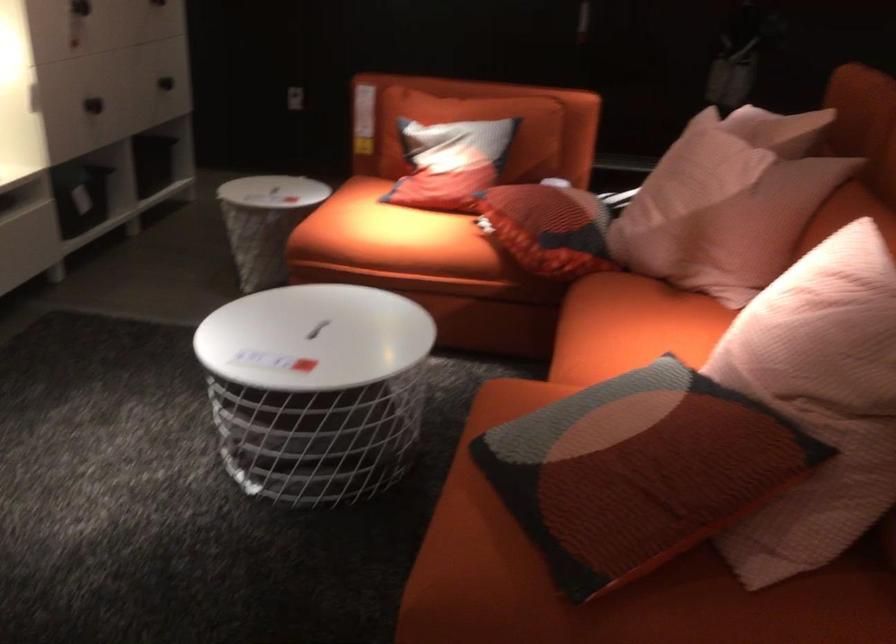
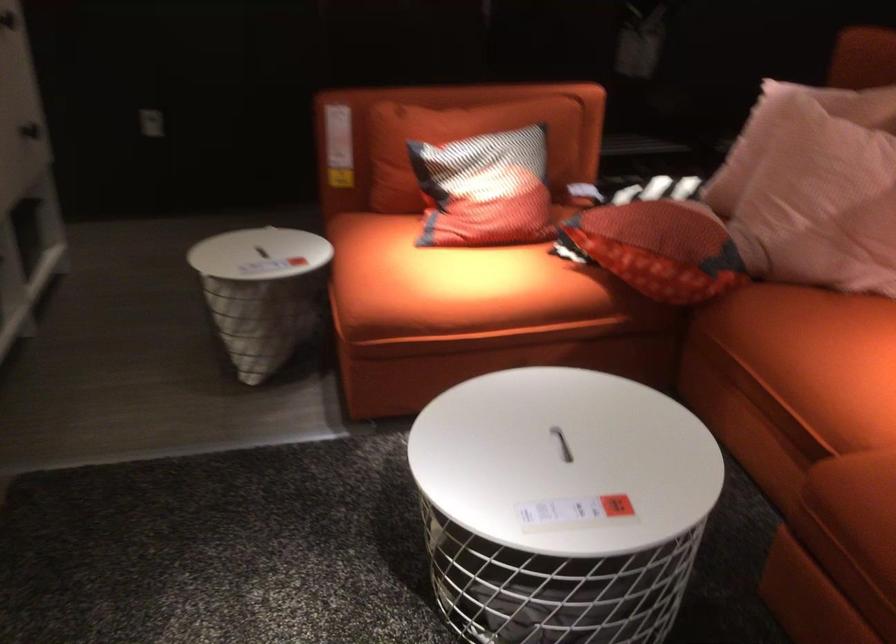
In the second image, find the point that corresponds to pixel 526 225 in the first image.

(659, 248)